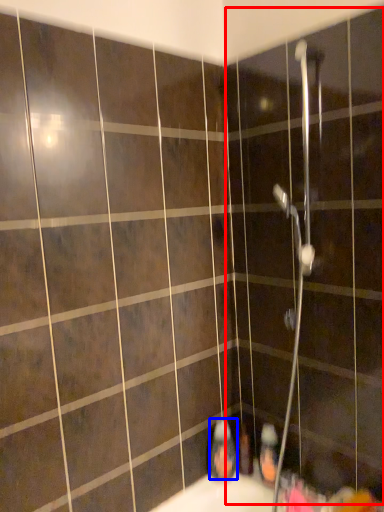
Question: Among these objects, which one is nearest to the camera, screen door (highlighted by a red box) or toiletry (highlighted by a blue box)?

Choices:
 (A) screen door
 (B) toiletry

Answer: (A)